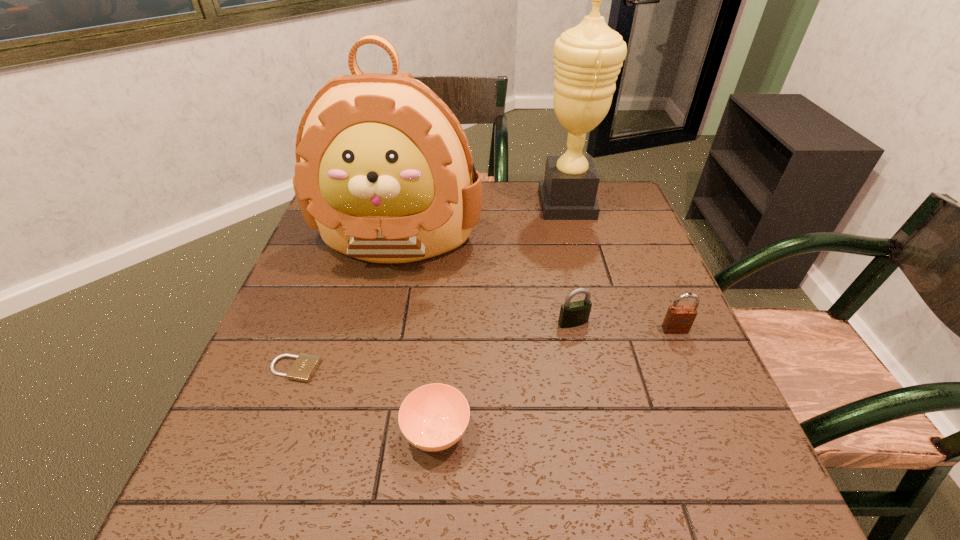
Locate an element on the screen. The height and width of the screenshot is (540, 960). vacant space located 0.260m at the front of the trophy cup with handles is located at coordinates (452, 204).

Find the location of a particular element. free space located on the front-facing side of the backpack is located at coordinates pos(369,365).

Identify the location of free region located 0.230m on the front-facing side of the rightmost padlock. (719, 432).

Image resolution: width=960 pixels, height=540 pixels. In order to click on free point located 0.140m on the right of the second padlock from left to right in this screenshot , I will do `click(651, 322)`.

This screenshot has width=960, height=540. Identify the location of free spot located 0.380m on the right of the nearest object. (684, 431).

Where is `free space located on the right of the fifth farthest object`? This screenshot has width=960, height=540. free space located on the right of the fifth farthest object is located at coordinates (373, 369).

Locate an element on the screen. trophy cup that is at the far edge is located at coordinates click(588, 57).

This screenshot has width=960, height=540. Identify the location of backpack located at the far edge. click(384, 170).

Find the location of a particular element. This screenshot has width=960, height=540. object that is at the near edge is located at coordinates (434, 417).

In order to click on backpack at the left edge in this screenshot , I will do `click(384, 170)`.